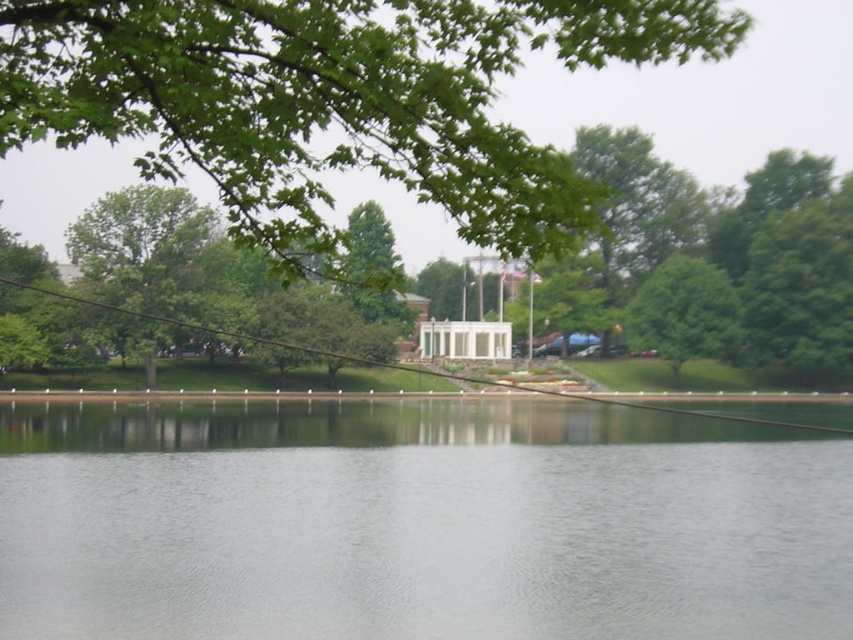
Question: In this image, where is green leafy branch at upper center located relative to green leafy tree at center?

Choices:
 (A) below
 (B) above

Answer: (B)

Question: Is clear water at center above green leafy branch at upper center?

Choices:
 (A) yes
 (B) no

Answer: (B)

Question: Where is clear water at center located in relation to green leafy tree at center in the image?

Choices:
 (A) below
 (B) above

Answer: (A)

Question: Which point is farther from the camera taking this photo?

Choices:
 (A) (651, 273)
 (B) (698, 435)
 (C) (483, 77)

Answer: (A)

Question: Which object is farther from the camera taking this photo?

Choices:
 (A) green leafy tree at center
 (B) clear water at center

Answer: (A)

Question: Which point appears farthest from the camera in this image?

Choices:
 (A) (267, 147)
 (B) (711, 305)

Answer: (B)